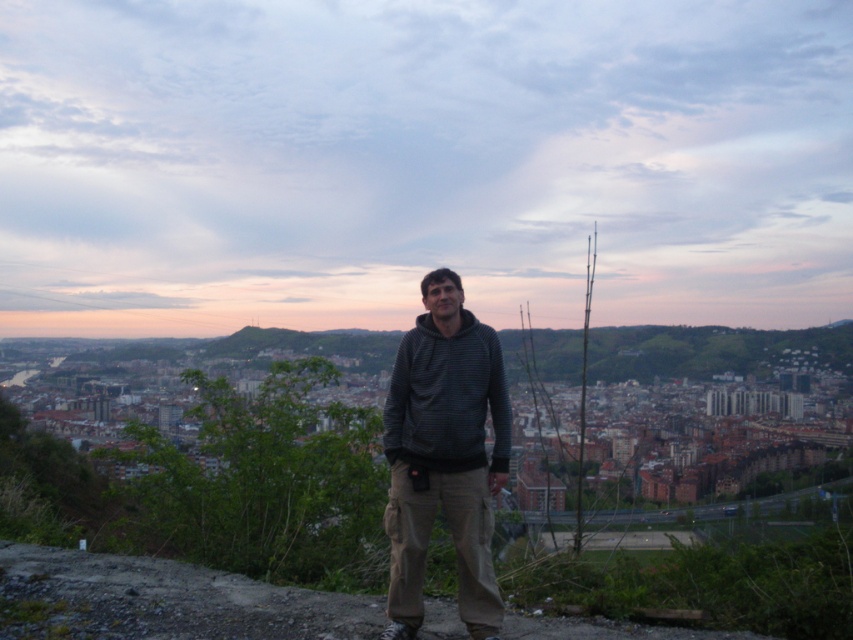
You are standing at point [437,348] and want to walk to point [497,364]. Which direction should you move to reach your destination?

You should move backward to reach point [497,364] because point [437,348] is in front of it.

You are a photographer trying to capture both the dark gray hoodie at center and the dark gray striped hoodie at center in a single shot. However, you notice that one of them is significantly taller than the other. Which hoodie would you need to position closer to the camera to ensure both appear roughly the same height in the photo?

The dark gray hoodie at center is much taller than the dark gray striped hoodie at center. To make them appear the same height in the photo, position the shorter dark gray striped hoodie at center closer to the camera while keeping the taller dark gray hoodie at center further back.